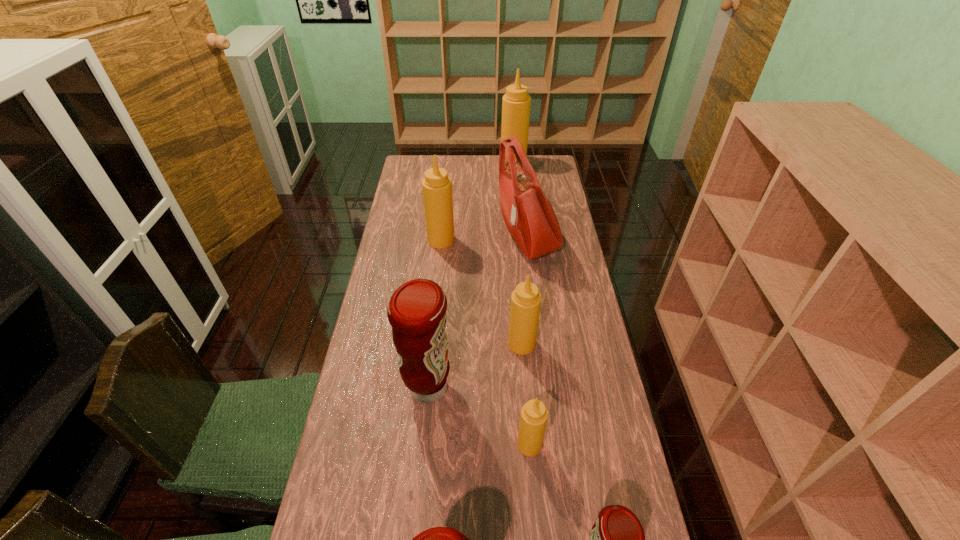
What are the coordinates of `the tallest condiment` in the screenshot? It's located at (516, 103).

Locate an element on the screen. This screenshot has width=960, height=540. the farthest tan condiment is located at coordinates (516, 103).

You are a GUI agent. You are given a task and a screenshot of the screen. Output one action in this format:
    pyautogui.click(x=<x>, y=<y>)
    Task: Click on the red handbag
    This screenshot has height=540, width=960.
    Given the screenshot: What is the action you would take?
    pyautogui.click(x=527, y=212)

This screenshot has width=960, height=540. Find the location of `the third smallest tan condiment`. the third smallest tan condiment is located at coordinates (436, 186).

What are the coordinates of `the second farthest condiment` in the screenshot? It's located at (436, 186).

Where is `the biggest red condiment`? The width and height of the screenshot is (960, 540). the biggest red condiment is located at coordinates (416, 311).

Where is `the farthest red condiment`? the farthest red condiment is located at coordinates (416, 311).

The height and width of the screenshot is (540, 960). I want to click on the second nearest tan condiment, so click(x=525, y=305).

At what (x,y) coordinates should I click in order to perform the action: click on the third farthest condiment. Please return your answer as a coordinate pair (x, y). Looking at the image, I should click on (525, 305).

This screenshot has width=960, height=540. Find the location of `the third nearest object`. the third nearest object is located at coordinates (533, 419).